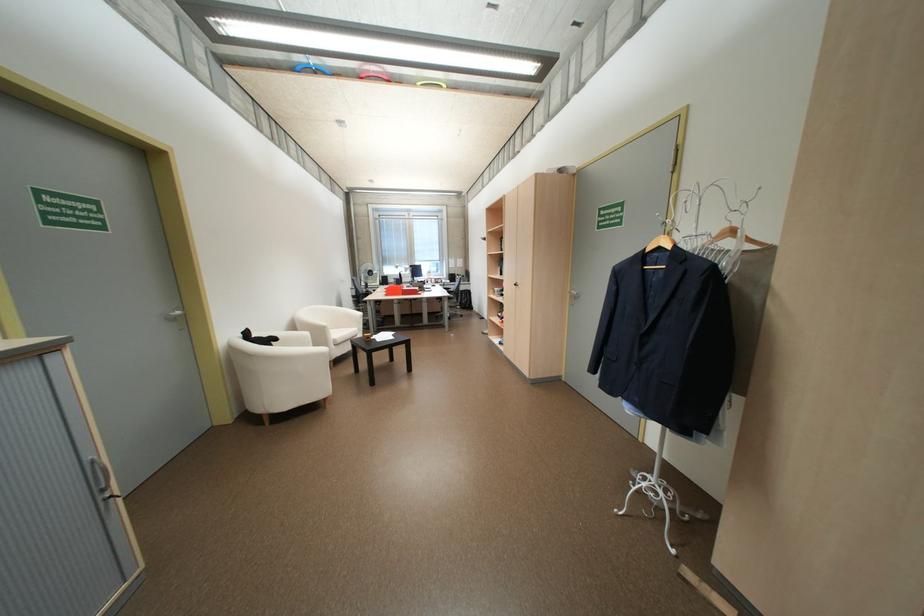
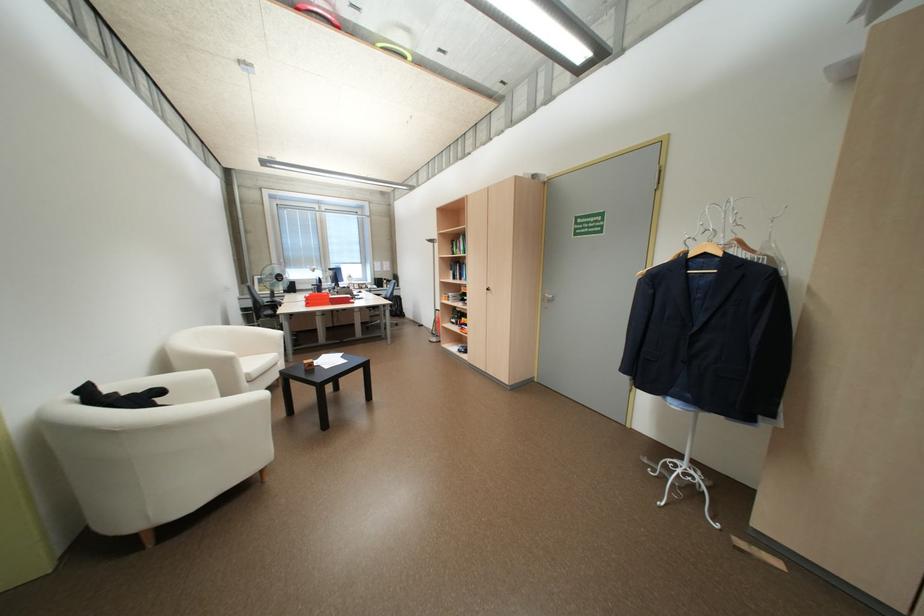
In a continuous first-person perspective shot, in which direction is the camera moving?

The cameraman moved toward left, forward.